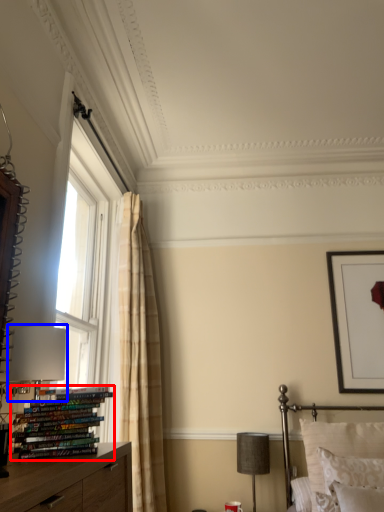
Question: Which object is further to the camera taking this photo, book (highlighted by a red box) or table lamp (highlighted by a blue box)?

Choices:
 (A) book
 (B) table lamp

Answer: (B)